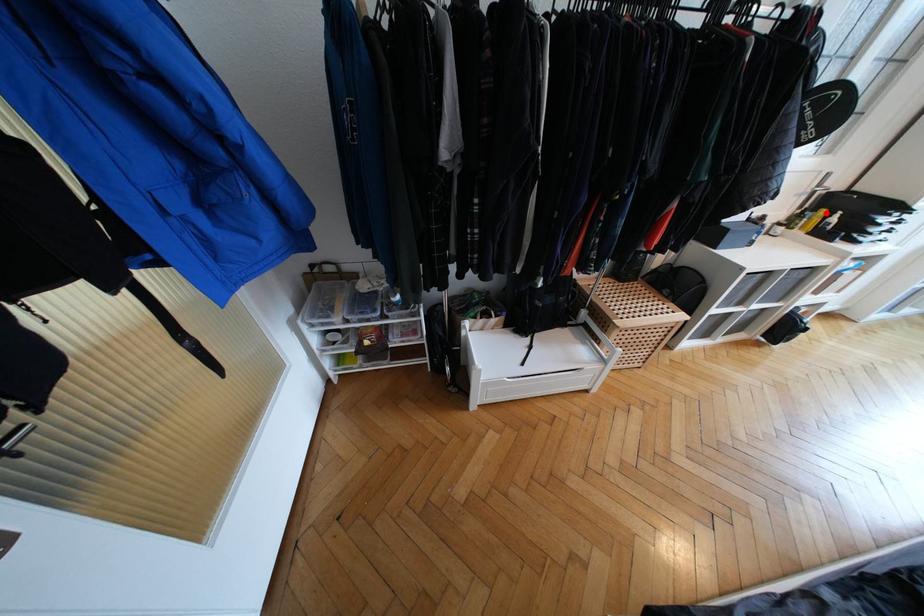
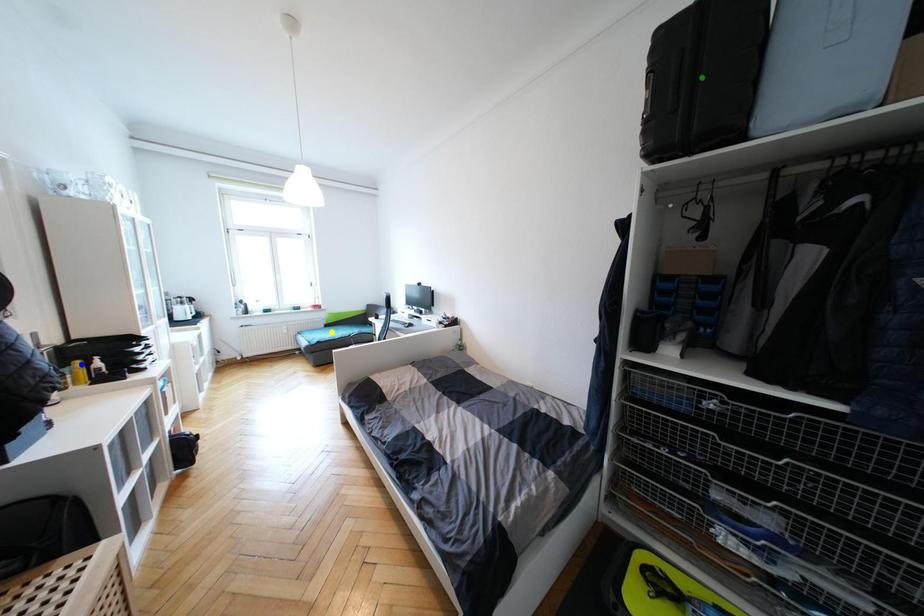
Question: I am providing you with two images of the same scene from different viewpoints. A red point is marked on the first image. You are given multiple points on the second image. Which mark in image 2 goes with the point in image 1?

Choices:
 (A) yellow point
 (B) green point
 (C) blue point

Answer: (C)